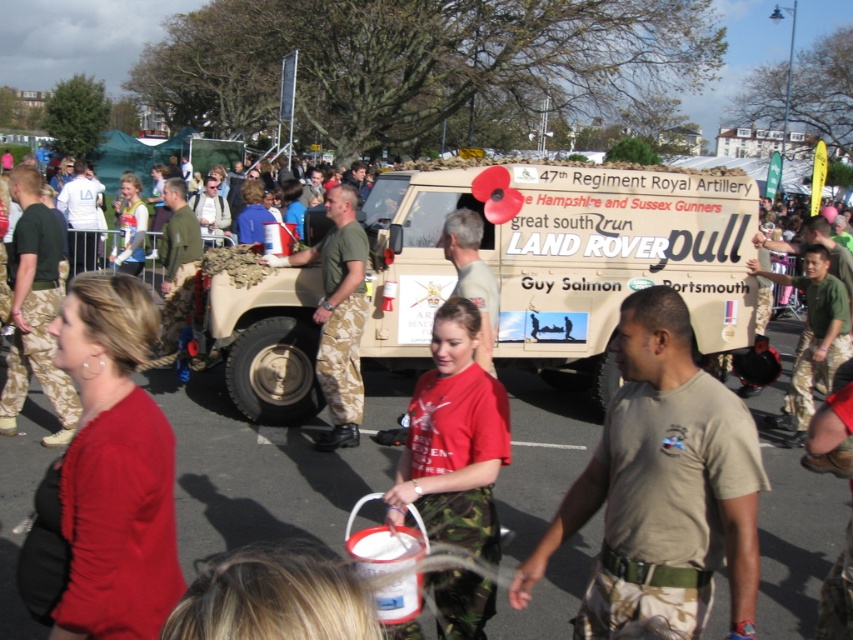
You are a photographer at the event and need to capture both the tan matte land rover at center and the camouflage uniform at center in a single photo. Given their sizes, which object should you focus on to ensure both are clearly visible in the frame?

The tan matte land rover at center is larger than the camouflage uniform at center, so focusing on the land rover while positioning it centrally would allow the smaller camouflage uniform to remain in the frame and visible.